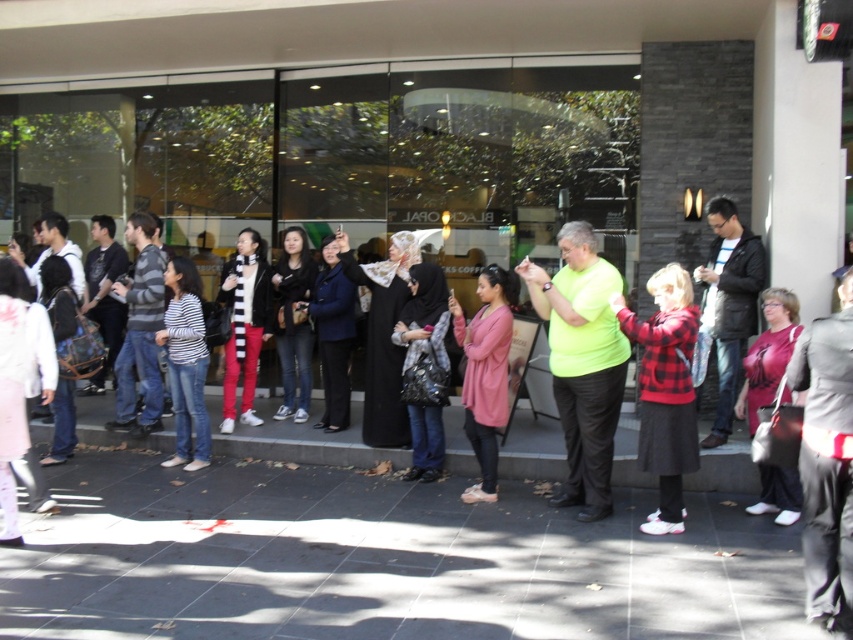
How far apart are striped sweater at center and black leather jacket at center?

They are 1.27 meters apart.

Which is more to the right, striped sweater at center or black leather jacket at center?

black leather jacket at center is more to the right.

Describe the element at coordinates (140, 332) in the screenshot. Image resolution: width=853 pixels, height=640 pixels. I see `striped sweater at center` at that location.

Image resolution: width=853 pixels, height=640 pixels. I want to click on striped sweater at center, so click(x=140, y=332).

Who is more forward, (421, 444) or (200, 346)?

Point (421, 444)

Measure the distance between matte black hijab at center and camera.

matte black hijab at center and camera are 19.27 feet apart from each other.

What do you see at coordinates (424, 368) in the screenshot? The width and height of the screenshot is (853, 640). I see `matte black hijab at center` at bounding box center [424, 368].

The height and width of the screenshot is (640, 853). What are the coordinates of `matte black hijab at center` in the screenshot? It's located at (424, 368).

Based on the photo, can you confirm if pink matte cardigan at center is positioned above black leather jacket at center?

Incorrect, pink matte cardigan at center is not positioned above black leather jacket at center.

Does pink matte cardigan at center appear on the left side of black leather jacket at center?

No, pink matte cardigan at center is not to the left of black leather jacket at center.

Measure the distance between point (x=480, y=394) and camera.

Point (x=480, y=394) is 5.64 meters from camera.

At what (x,y) coordinates should I click in order to perform the action: click on pink matte cardigan at center. Please return your answer as a coordinate pair (x, y). Looking at the image, I should click on (485, 371).